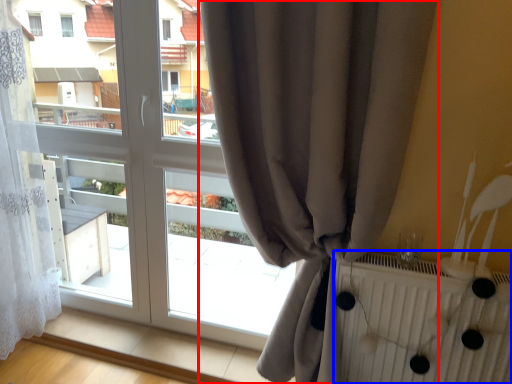
Question: Which object is further to the camera taking this photo, curtain (highlighted by a red box) or radiator (highlighted by a blue box)?

Choices:
 (A) curtain
 (B) radiator

Answer: (B)